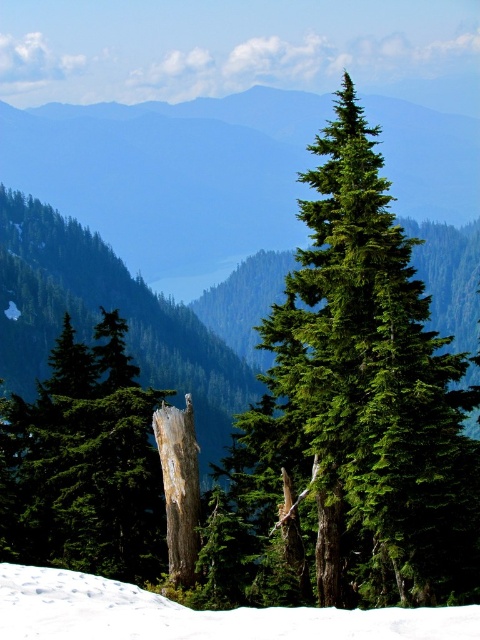
Question: Is white snow at lower left closer to camera compared to white textured bark at center?

Choices:
 (A) no
 (B) yes

Answer: (B)

Question: Can you confirm if green needle-like at center is positioned above white snow at lower left?

Choices:
 (A) yes
 (B) no

Answer: (B)

Question: Is the position of white snow at lower left less distant than that of white textured bark at center?

Choices:
 (A) no
 (B) yes

Answer: (B)

Question: Which object is positioned closest to the green needle-like at center?

Choices:
 (A) white textured bark at center
 (B) white snow at lower left

Answer: (A)

Question: Estimate the real-world distances between objects in this image. Which object is farther from the green needle-like at center?

Choices:
 (A) white textured bark at center
 (B) white snow at lower left

Answer: (B)

Question: Which point is farther to the camera?

Choices:
 (A) (316, 630)
 (B) (402, 237)

Answer: (B)